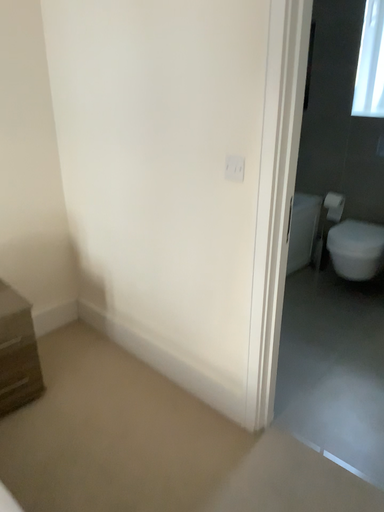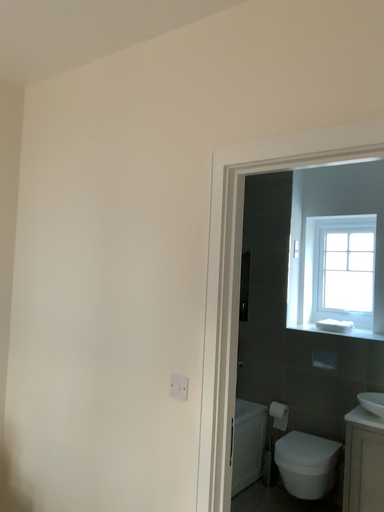
Question: How did the camera likely rotate when shooting the video?

Choices:
 (A) rotated downward
 (B) rotated upward

Answer: (B)